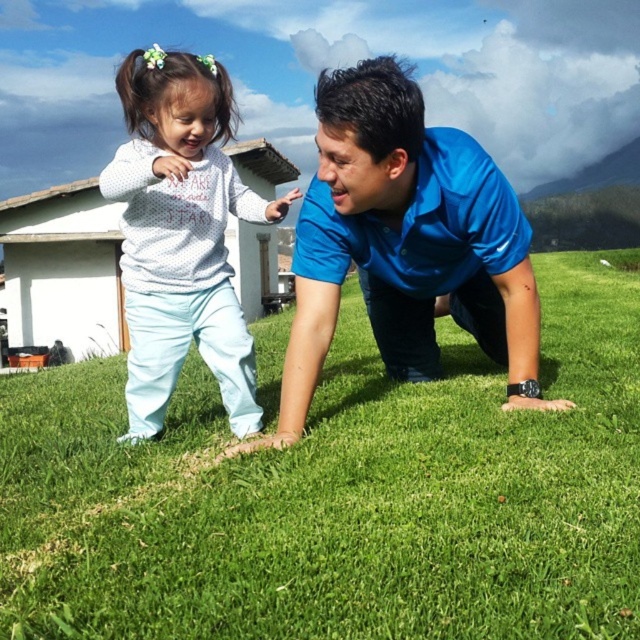
Based on the photo, is green grass at center in front of white dotted sweater at upper left?

Yes, green grass at center is in front of white dotted sweater at upper left.

The width and height of the screenshot is (640, 640). What do you see at coordinates (340, 493) in the screenshot? I see `green grass at center` at bounding box center [340, 493].

Does point (100, 477) come behind point (140, 60)?

Yes, it is behind point (140, 60).

The width and height of the screenshot is (640, 640). Find the location of `green grass at center`. green grass at center is located at coordinates (340, 493).

Between green grass at center and blue smooth shirt at center, which one is positioned higher?

blue smooth shirt at center is higher up.

Does green grass at center appear on the left side of blue smooth shirt at center?

Incorrect, green grass at center is not on the left side of blue smooth shirt at center.

Looking at this image, who is more distant from viewer, (236, 564) or (384, 58)?

The point (384, 58) is more distant.

Where is `green grass at center`? This screenshot has height=640, width=640. green grass at center is located at coordinates (340, 493).

Does blue smooth shirt at center appear under white dotted sweater at upper left?

Yes.

Identify the location of blue smooth shirt at center. (404, 243).